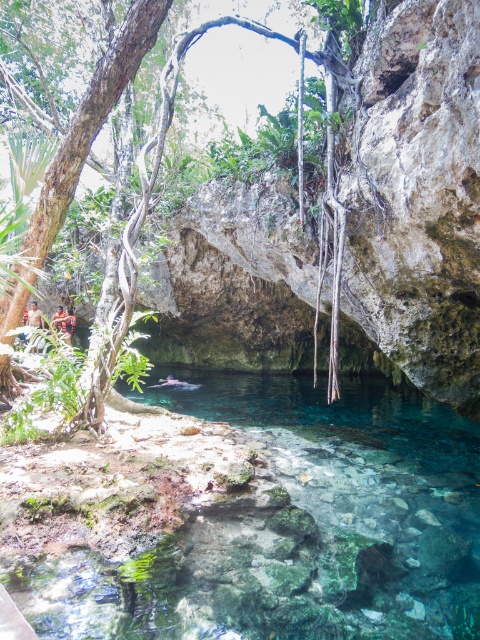
Is clear glass water at center below green leafy tree at center?

→ Indeed, clear glass water at center is positioned under green leafy tree at center.

Can you confirm if clear glass water at center is smaller than green leafy tree at center?

No, clear glass water at center is not smaller than green leafy tree at center.

At what (x,y) coordinates should I click in order to perform the action: click on clear glass water at center. Please return your answer as a coordinate pair (x, y). Looking at the image, I should click on (295, 528).